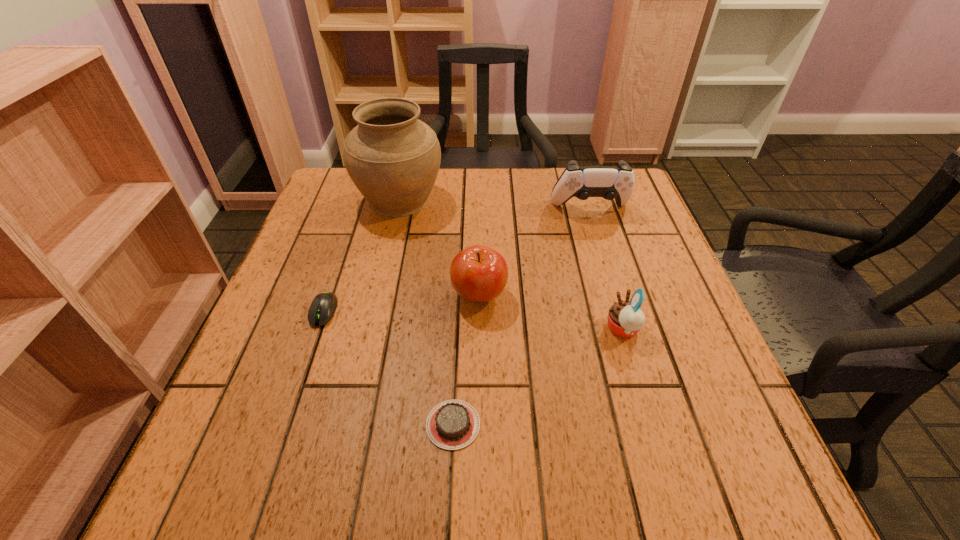
This screenshot has height=540, width=960. What are the coordinates of `free region located on the front-facing side of the muffin` in the screenshot? It's located at (534, 329).

I want to click on vacant space located 0.110m on the front-facing side of the muffin, so click(549, 329).

Locate an element on the screen. The image size is (960, 540). vacant area situated 0.390m on the front-facing side of the muffin is located at coordinates (405, 329).

Locate an element on the screen. vacant space located on the wheel side of the fifth tallest object is located at coordinates (283, 431).

The width and height of the screenshot is (960, 540). In order to click on vacant space located on the right of the chocolate cake in this screenshot , I will do `click(665, 424)`.

Where is `urn that is at the far edge`? This screenshot has width=960, height=540. urn that is at the far edge is located at coordinates (393, 158).

Find the location of `control located in the far edge section of the desktop`. control located in the far edge section of the desktop is located at coordinates (609, 182).

Where is `object at the near edge`? This screenshot has width=960, height=540. object at the near edge is located at coordinates (453, 424).

Where is `urn that is at the left edge`? Image resolution: width=960 pixels, height=540 pixels. urn that is at the left edge is located at coordinates (393, 158).

The height and width of the screenshot is (540, 960). I want to click on computer mouse present at the left edge, so click(x=323, y=306).